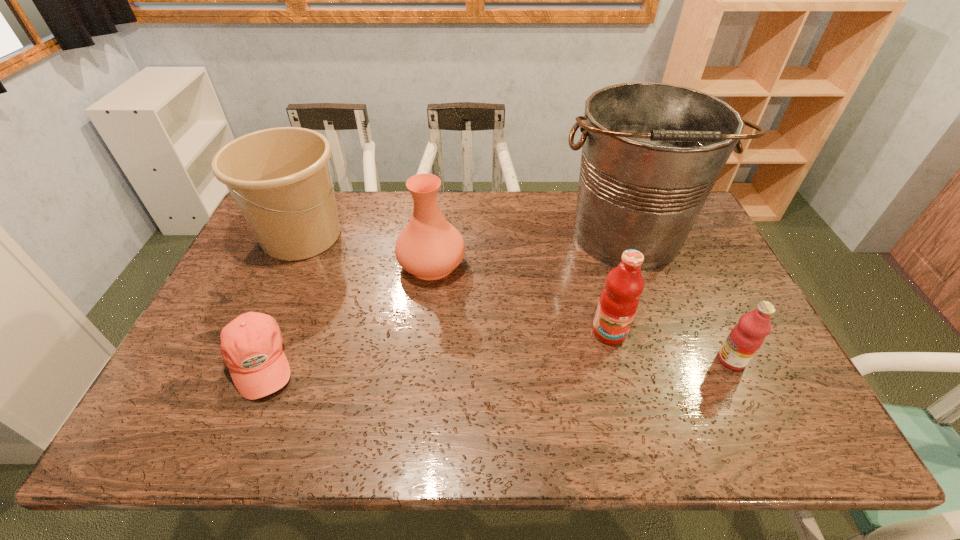
Identify the location of vacant area that lies between the left bucket and the fifth tallest object. This screenshot has width=960, height=540. (516, 298).

Find the location of `blank region between the shorter bucket and the left fruit juice`. blank region between the shorter bucket and the left fruit juice is located at coordinates (455, 284).

The height and width of the screenshot is (540, 960). Find the location of `empty space that is in between the fourth object from right to left and the nearer fruit juice`. empty space that is in between the fourth object from right to left and the nearer fruit juice is located at coordinates (582, 312).

What are the coordinates of `empty location between the baseball cap and the fourth object from right to left` in the screenshot? It's located at (346, 313).

The width and height of the screenshot is (960, 540). Find the location of `vacant area that lies between the tallest object and the fifth tallest object`. vacant area that lies between the tallest object and the fifth tallest object is located at coordinates (679, 298).

Image resolution: width=960 pixels, height=540 pixels. I want to click on object that ranks as the fifth closest to the right fruit juice, so click(280, 178).

Locate an element on the screen. The height and width of the screenshot is (540, 960). object that can be found as the third closest to the shorter fruit juice is located at coordinates pyautogui.click(x=429, y=247).